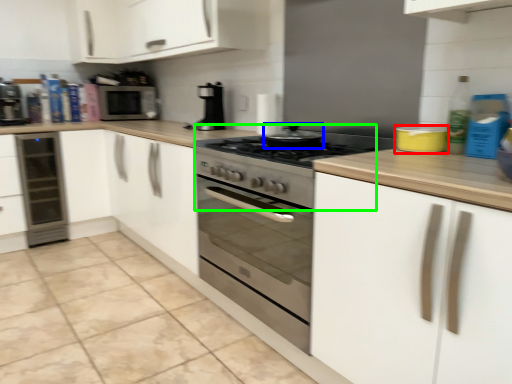
Question: Which object is positioned closest to appliance (highlighted by a red box)? Select from appliance (highlighted by a blue box) and gas stove (highlighted by a green box).

Choices:
 (A) appliance
 (B) gas stove

Answer: (A)